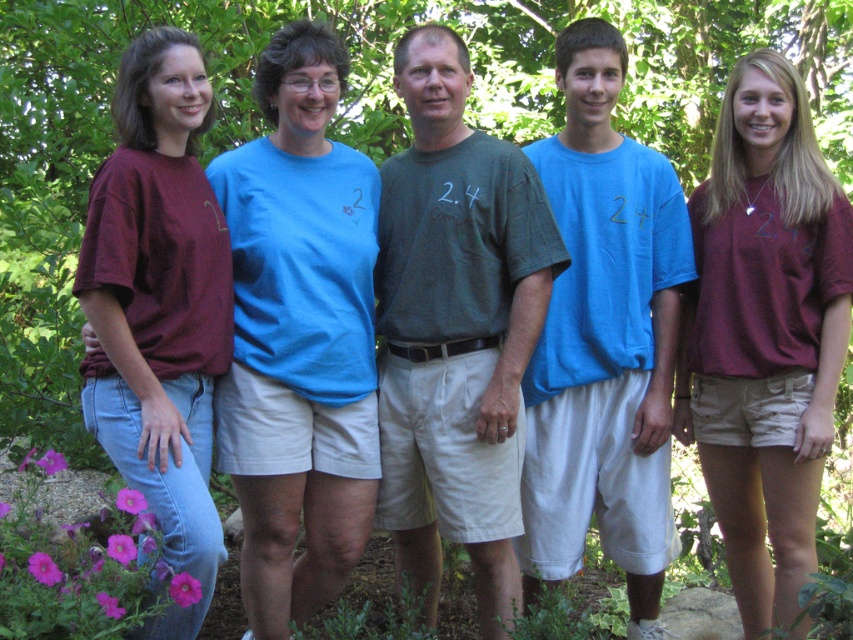
Question: Which point is closer to the camera taking this photo?

Choices:
 (A) (112, 444)
 (B) (631, 400)
 (C) (252, 442)

Answer: (A)

Question: Is blue cotton shirt at center below matte burgundy t-shirt at left?

Choices:
 (A) no
 (B) yes

Answer: (B)

Question: Can you confirm if burgundy cotton t-shirt at center is positioned to the right of matte burgundy t-shirt at left?

Choices:
 (A) no
 (B) yes

Answer: (B)

Question: Which object is positioned closest to the dark green t-shirt at center?

Choices:
 (A) burgundy cotton t-shirt at center
 (B) blue cotton t-shirt at center

Answer: (B)

Question: Does blue cotton t-shirt at center have a smaller size compared to matte burgundy t-shirt at left?

Choices:
 (A) yes
 (B) no

Answer: (B)

Question: Which point is farther from the camera taking this photo?

Choices:
 (A) (242, 234)
 (B) (135, 353)

Answer: (A)